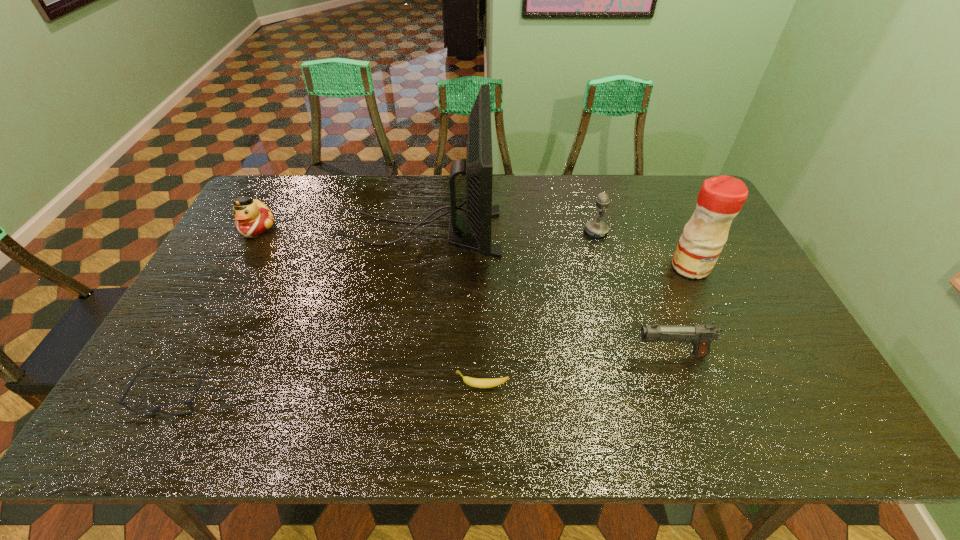
Where is `free space located on the front-facing side of the microphone`? free space located on the front-facing side of the microphone is located at coordinates (543, 231).

Locate an element on the screen. Image resolution: width=960 pixels, height=540 pixels. vacant point located on the front-facing side of the microphone is located at coordinates (493, 231).

Image resolution: width=960 pixels, height=540 pixels. In order to click on vacant space positioned on the front-facing side of the microphone in this screenshot , I will do pos(528,231).

Identify the location of blank space located 0.100m on the face of the duck. (237, 264).

Image resolution: width=960 pixels, height=540 pixels. I want to click on vacant region located 0.150m in the direction the third nearest object is aimed, so click(572, 354).

This screenshot has width=960, height=540. Find the location of `free space located in the direction the third nearest object is aimed`. free space located in the direction the third nearest object is aimed is located at coordinates 564,354.

What are the coordinates of `vacant space located in the direction the third nearest object is aimed` in the screenshot? It's located at (532, 354).

Where is `vacant region located at the stem of the banana`? This screenshot has height=540, width=960. vacant region located at the stem of the banana is located at coordinates (302, 386).

Where is `vacant space situated at the stem of the banana`? Image resolution: width=960 pixels, height=540 pixels. vacant space situated at the stem of the banana is located at coordinates (371, 386).

Where is `vacant space situated 0.230m at the stem of the banana`? Image resolution: width=960 pixels, height=540 pixels. vacant space situated 0.230m at the stem of the banana is located at coordinates (358, 386).